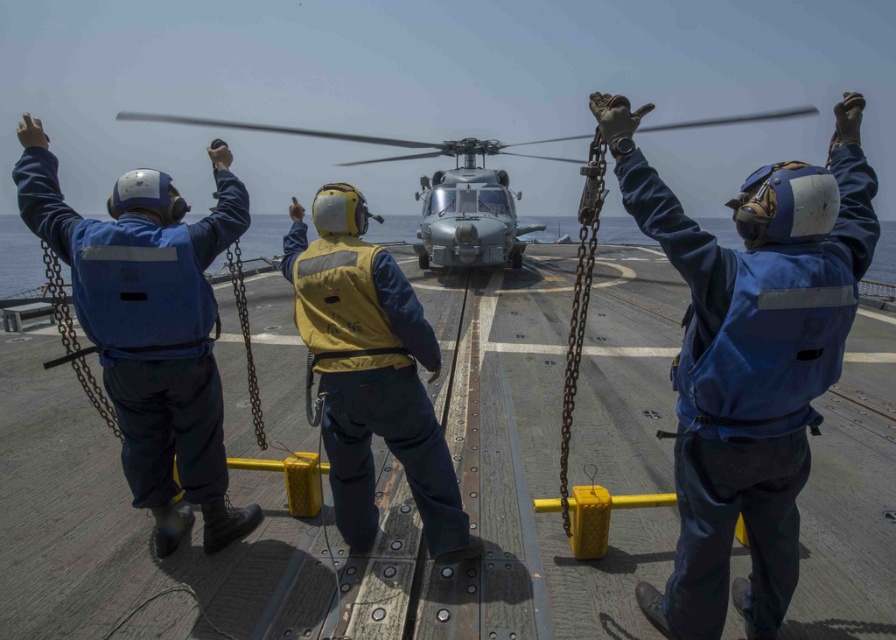
You are a deck handler on the naval ship. You need to secure the blue fabric helmet at upper left and the metallic gray helicopter at center. Which object requires more space to handle?

The metallic gray helicopter at center requires more space to handle because it is larger than the blue fabric helmet at upper left.

You are a deck handler on the naval ship and need to ensure that the blue fabric helmet at upper left can fit into a storage compartment designed for items smaller than the metallic gray helicopter at center. Based on the scene, can the helmet fit?

The blue fabric helmet at upper left has a width less than the metallic gray helicopter at center, so it can fit into the storage compartment designed for items smaller than the helicopter.